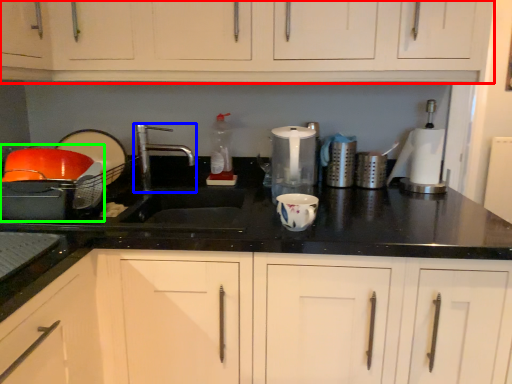
Question: Which object is positioned closest to cabinetry (highlighted by a red box)? Select from tap (highlighted by a blue box) and appliance (highlighted by a green box).

Choices:
 (A) tap
 (B) appliance

Answer: (B)